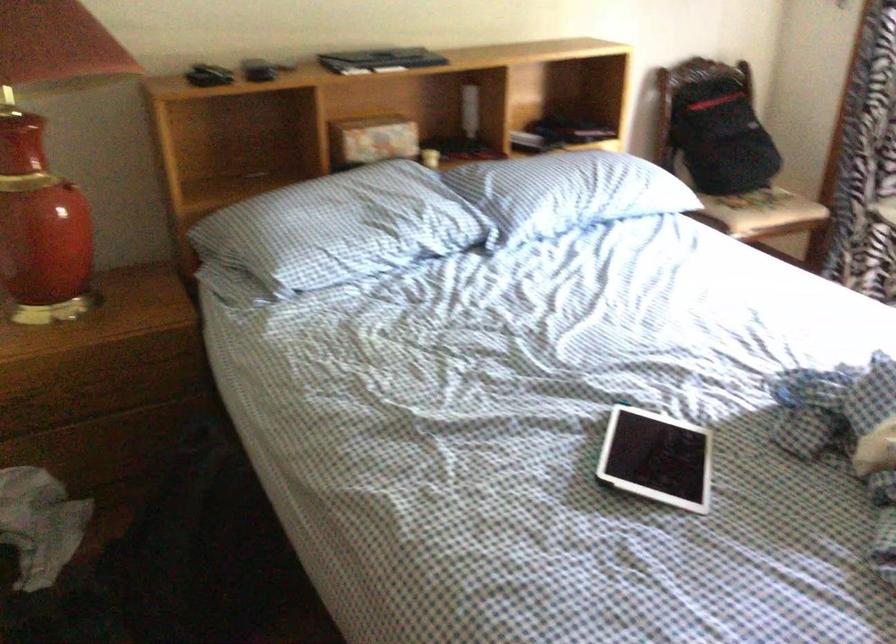
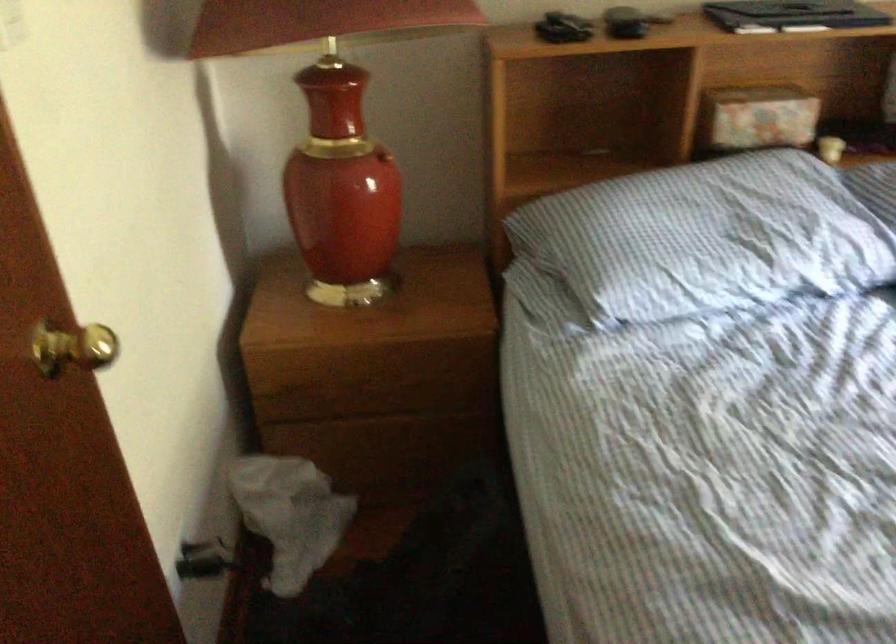
The point at (x=349, y=225) is marked in the first image. Where is the corresponding point in the second image?

(707, 238)